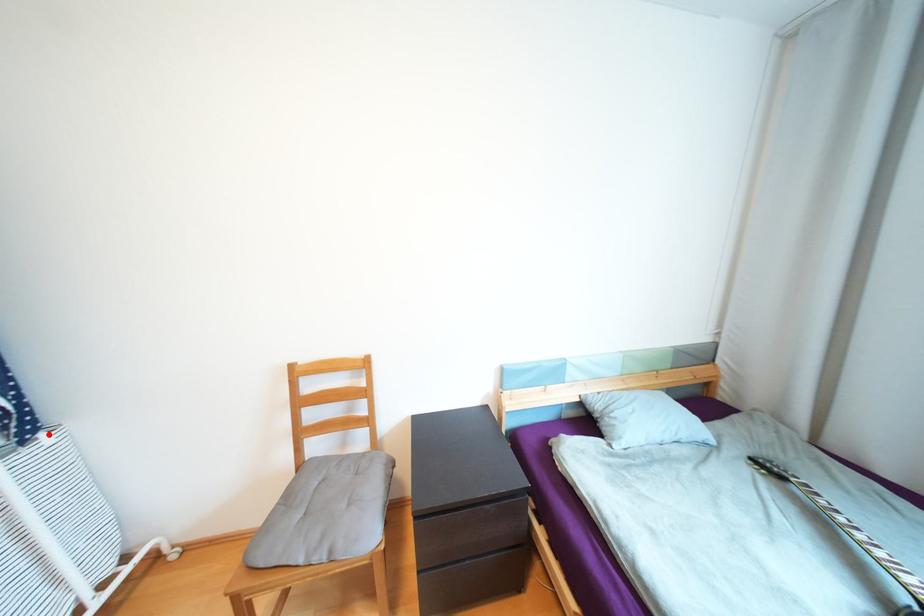
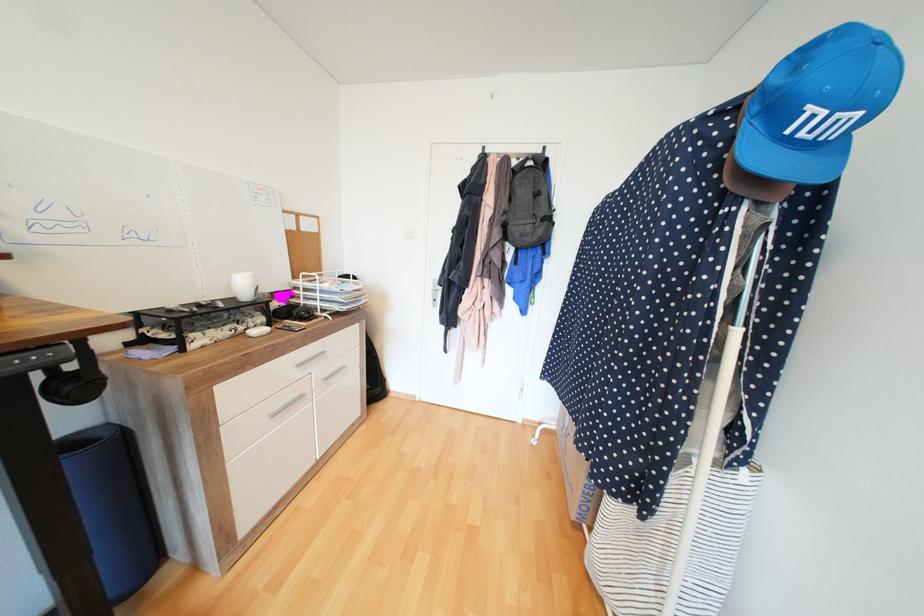
Where in the second image is the point corresponding to the highlighted location from the first image?

(750, 471)